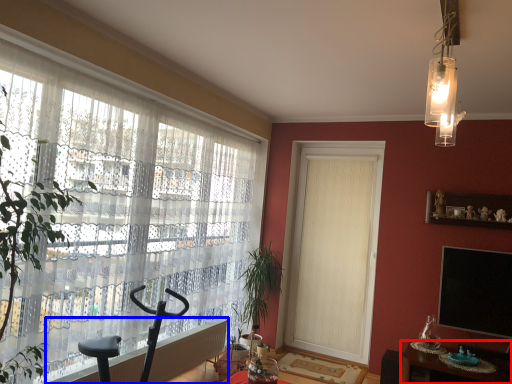
Question: Which object is closer to the camera taking this photo, table (highlighted by a red box) or radiator (highlighted by a blue box)?

Choices:
 (A) table
 (B) radiator

Answer: (B)